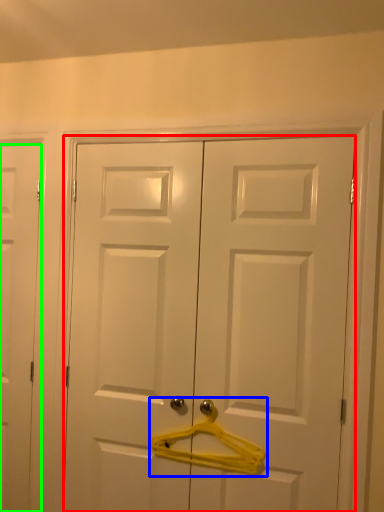
Question: Based on their relative distances, which object is nearer to door (highlighted by a red box)? Choose from hanger (highlighted by a blue box) and door (highlighted by a green box).

Choices:
 (A) hanger
 (B) door

Answer: (A)